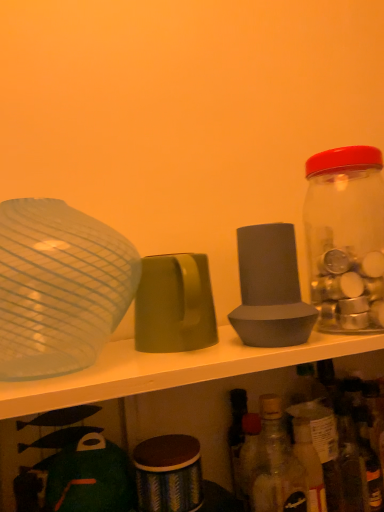
Question: Is transparent glass bowl at left, which is the 1th tableware from left to right, not near matte green cup at center, the 2th tableware viewed from the left?

Choices:
 (A) no
 (B) yes

Answer: (A)

Question: From the image's perspective, is transparent glass bowl at left, which is the 1th tableware from left to right, beneath matte green cup at center, the 2th tableware viewed from the left?

Choices:
 (A) yes
 (B) no

Answer: (B)

Question: From a real-world perspective, is transparent glass bowl at left, which is the 3th tableware from right to left, on matte green cup at center, the 2th tableware viewed from the left?

Choices:
 (A) no
 (B) yes

Answer: (B)

Question: Considering the relative sizes of transparent glass bowl at left, which is the 1th tableware from left to right, and matte green cup at center, the 2th tableware viewed from the left, in the image provided, is transparent glass bowl at left, which is the 1th tableware from left to right, shorter than matte green cup at center, the 2th tableware viewed from the left,?

Choices:
 (A) yes
 (B) no

Answer: (B)

Question: Is transparent glass bowl at left, which is the 1th tableware from left to right, taller than matte green cup at center, the 2th tableware positioned from the right?

Choices:
 (A) no
 (B) yes

Answer: (B)

Question: Is matte green cup at center, the 2th tableware positioned from the right, inside transparent glass bowl at left, which is the 3th tableware from right to left?

Choices:
 (A) no
 (B) yes

Answer: (A)

Question: Does gray matte speaker at center, which ranks as the 3th tableware in left-to-right order, turn towards translucent glass bottle at lower right, acting as the 1th bottle starting from the bottom?

Choices:
 (A) yes
 (B) no

Answer: (B)

Question: Are gray matte speaker at center, which ranks as the 3th tableware in left-to-right order, and translucent glass bottle at lower right, acting as the 1th bottle starting from the bottom, far apart?

Choices:
 (A) no
 (B) yes

Answer: (A)

Question: From the image's perspective, does gray matte speaker at center, the 1th tableware in the right-to-left sequence, appear higher than translucent glass bottle at lower right, the second bottle from the right?

Choices:
 (A) no
 (B) yes

Answer: (B)

Question: Is gray matte speaker at center, the 1th tableware in the right-to-left sequence, wider than translucent glass bottle at lower right, which is the first bottle from left to right?

Choices:
 (A) yes
 (B) no

Answer: (A)

Question: Is gray matte speaker at center, the 1th tableware in the right-to-left sequence, in front of translucent glass bottle at lower right, acting as the 1th bottle starting from the bottom?

Choices:
 (A) yes
 (B) no

Answer: (B)

Question: Considering the relative sizes of gray matte speaker at center, which ranks as the 3th tableware in left-to-right order, and translucent glass bottle at lower right, which ranks as the 2th bottle in top-to-bottom order, in the image provided, is gray matte speaker at center, which ranks as the 3th tableware in left-to-right order, taller than translucent glass bottle at lower right, which ranks as the 2th bottle in top-to-bottom order,?

Choices:
 (A) no
 (B) yes

Answer: (A)

Question: Would you say matte green cup at center, the 2th tableware positioned from the right, contains translucent glass bottle at lower right, the second bottle from the right?

Choices:
 (A) yes
 (B) no

Answer: (B)